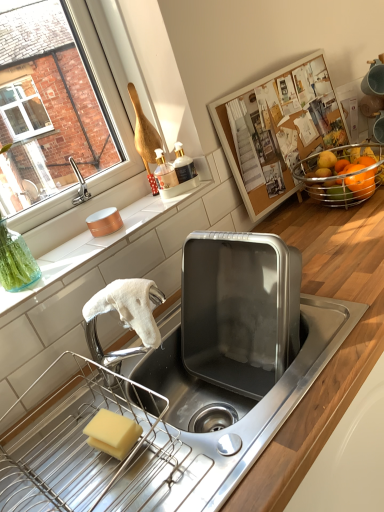
Question: Considering the relative sizes of orange matte at right and shiny orange fruit at upper right in the image provided, is orange matte at right wider than shiny orange fruit at upper right?

Choices:
 (A) no
 (B) yes

Answer: (A)

Question: Is orange matte at right facing towards shiny orange fruit at upper right?

Choices:
 (A) no
 (B) yes

Answer: (A)

Question: Is orange matte at right turned away from shiny orange fruit at upper right?

Choices:
 (A) no
 (B) yes

Answer: (A)

Question: Is orange matte at right surrounding shiny orange fruit at upper right?

Choices:
 (A) yes
 (B) no

Answer: (B)

Question: From a real-world perspective, is orange matte at right beneath shiny orange fruit at upper right?

Choices:
 (A) yes
 (B) no

Answer: (B)

Question: Considering the relative sizes of orange matte at right and shiny orange fruit at upper right in the image provided, is orange matte at right shorter than shiny orange fruit at upper right?

Choices:
 (A) no
 (B) yes

Answer: (B)

Question: Is wooden at lower right, the 2th countertop positioned from the top, bigger than shiny orange fruit at upper right?

Choices:
 (A) no
 (B) yes

Answer: (B)

Question: Does wooden at lower right, the 2th countertop positioned from the top, appear on the right side of shiny orange fruit at upper right?

Choices:
 (A) yes
 (B) no

Answer: (B)

Question: From a real-world perspective, is wooden at lower right, the 1th countertop positioned from the bottom, under shiny orange fruit at upper right?

Choices:
 (A) no
 (B) yes

Answer: (B)

Question: Is wooden at lower right, the 2th countertop positioned from the top, closer to the viewer compared to shiny orange fruit at upper right?

Choices:
 (A) no
 (B) yes

Answer: (B)

Question: Is wooden at lower right, the 2th countertop positioned from the top, positioned with its back to shiny orange fruit at upper right?

Choices:
 (A) yes
 (B) no

Answer: (B)

Question: Is wooden at lower right, the 1th countertop positioned from the bottom, not close to shiny orange fruit at upper right?

Choices:
 (A) yes
 (B) no

Answer: (B)

Question: Is yellow sponge at lower left further to the viewer compared to orange matte at right?

Choices:
 (A) yes
 (B) no

Answer: (B)